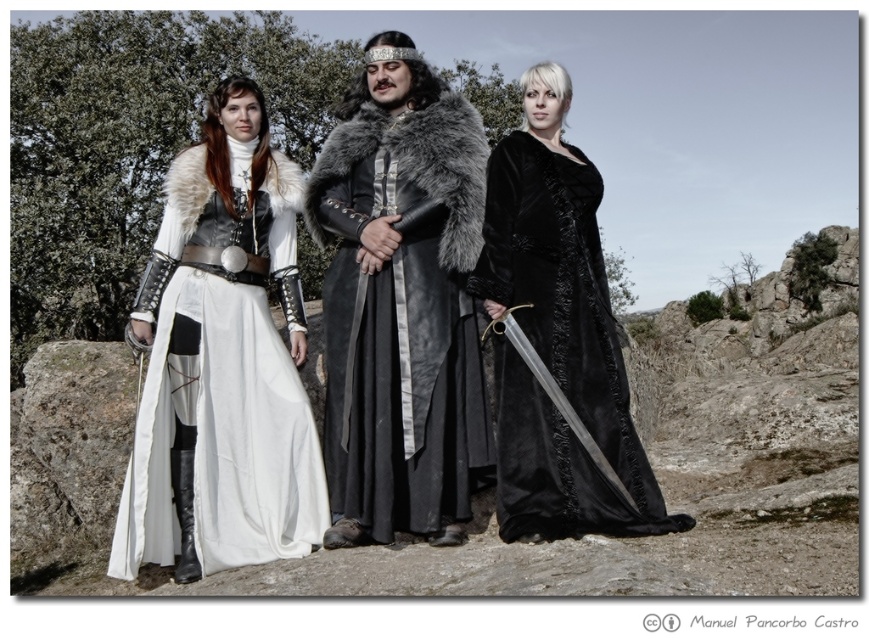
Question: Estimate the real-world distances between objects in this image. Which object is closer to the leather fur-trimmed cloak at center?

Choices:
 (A) white matte fabric dress at left
 (B) velvet black dress at center
 (C) white fur coat at center
 (D) fuzzy gray fur coat at center

Answer: (C)

Question: Can you confirm if white fur coat at center is wider than white matte fabric dress at left?

Choices:
 (A) no
 (B) yes

Answer: (B)

Question: Among these points, which one is farthest from the camera?

Choices:
 (A) (397, 150)
 (B) (240, 176)
 (C) (327, 484)
 (D) (548, 362)

Answer: (B)

Question: Is the position of white matte fabric dress at left more distant than that of leather fur-trimmed cloak at center?

Choices:
 (A) yes
 (B) no

Answer: (B)

Question: Where is white matte fabric dress at left located in relation to velvet black dress at center in the image?

Choices:
 (A) right
 (B) left

Answer: (B)

Question: Which point is farther from the camera taking this photo?

Choices:
 (A) (529, 355)
 (B) (204, 220)
 (C) (483, 188)

Answer: (C)